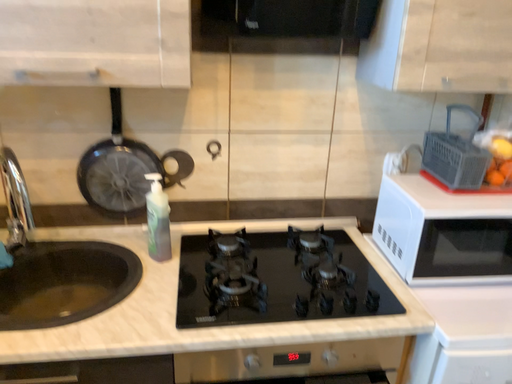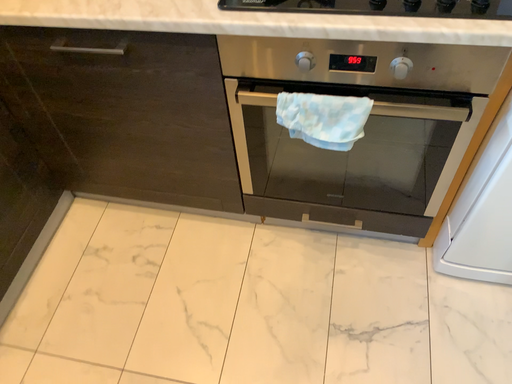
Question: How did the camera likely rotate when shooting the video?

Choices:
 (A) rotated upward
 (B) rotated downward

Answer: (B)